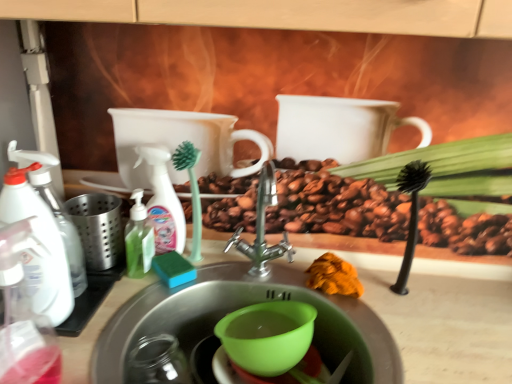
Question: Should I look upward or downward to see green plastic spray bottle at center, the 1th cleaning product from the right?

Choices:
 (A) up
 (B) down

Answer: (B)

Question: Considering the relative sizes of green translucent pump bottle at left, placed as the 2th cleaning product when sorted from right to left, and white plastic spray bottle at left, the 3th cleaning product from the right, in the image provided, is green translucent pump bottle at left, placed as the 2th cleaning product when sorted from right to left, bigger than white plastic spray bottle at left, the 3th cleaning product from the right,?

Choices:
 (A) no
 (B) yes

Answer: (A)

Question: Is green translucent pump bottle at left, which is the second cleaning product in left-to-right order, oriented away from white plastic spray bottle at left, which appears as the 1th cleaning product when viewed from the left?

Choices:
 (A) yes
 (B) no

Answer: (B)

Question: Is there a large distance between green translucent pump bottle at left, placed as the 2th cleaning product when sorted from right to left, and white plastic spray bottle at left, the 3th cleaning product from the right?

Choices:
 (A) no
 (B) yes

Answer: (A)

Question: From the image's perspective, does green translucent pump bottle at left, which is the second cleaning product in left-to-right order, appear higher than white plastic spray bottle at left, the 3th cleaning product from the right?

Choices:
 (A) yes
 (B) no

Answer: (B)

Question: Is green translucent pump bottle at left, placed as the 2th cleaning product when sorted from right to left, facing towards white plastic spray bottle at left, which appears as the 1th cleaning product when viewed from the left?

Choices:
 (A) yes
 (B) no

Answer: (B)

Question: Considering the relative positions of green translucent pump bottle at left, placed as the 2th cleaning product when sorted from right to left, and white plastic spray bottle at left, the 3th cleaning product from the right, in the image provided, is green translucent pump bottle at left, placed as the 2th cleaning product when sorted from right to left, to the right of white plastic spray bottle at left, the 3th cleaning product from the right, from the viewer's perspective?

Choices:
 (A) no
 (B) yes

Answer: (B)

Question: Is green translucent pump bottle at left, placed as the 2th cleaning product when sorted from right to left, thinner than green plastic spray bottle at center, the 1th cleaning product from the right?

Choices:
 (A) no
 (B) yes

Answer: (A)

Question: Considering the relative sizes of green translucent pump bottle at left, placed as the 2th cleaning product when sorted from right to left, and green plastic spray bottle at center, positioned as the third cleaning product in left-to-right order, in the image provided, is green translucent pump bottle at left, placed as the 2th cleaning product when sorted from right to left, smaller than green plastic spray bottle at center, positioned as the third cleaning product in left-to-right order,?

Choices:
 (A) no
 (B) yes

Answer: (B)

Question: From a real-world perspective, is green translucent pump bottle at left, placed as the 2th cleaning product when sorted from right to left, below green plastic spray bottle at center, the 1th cleaning product from the right?

Choices:
 (A) yes
 (B) no

Answer: (A)

Question: Does green translucent pump bottle at left, placed as the 2th cleaning product when sorted from right to left, have a greater width compared to green plastic spray bottle at center, the 1th cleaning product from the right?

Choices:
 (A) yes
 (B) no

Answer: (A)

Question: Is green plastic spray bottle at center, the 1th cleaning product from the right, at the back of green translucent pump bottle at left, placed as the 2th cleaning product when sorted from right to left?

Choices:
 (A) no
 (B) yes

Answer: (B)

Question: From a real-world perspective, is green translucent pump bottle at left, which is the second cleaning product in left-to-right order, over green plastic spray bottle at center, the 1th cleaning product from the right?

Choices:
 (A) no
 (B) yes

Answer: (A)

Question: Can you confirm if white plastic spray bottle at left, the 3th cleaning product from the right, is bigger than orange fabric at sink?

Choices:
 (A) yes
 (B) no

Answer: (A)